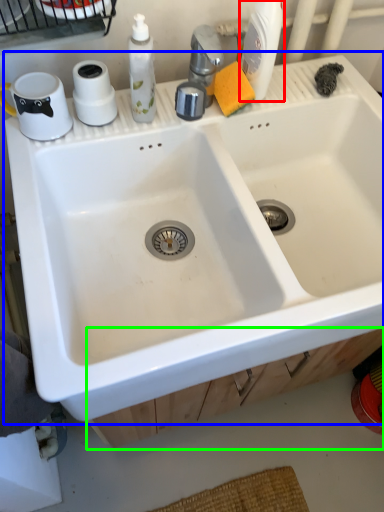
Question: Which object is positioned farthest from cleaning product (highlighted by a red box)? Select from sink (highlighted by a blue box) and drawer (highlighted by a green box).

Choices:
 (A) sink
 (B) drawer

Answer: (B)